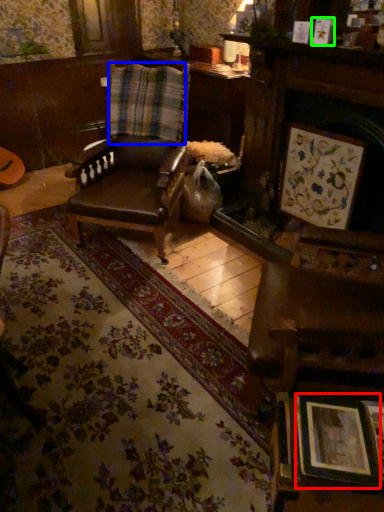
Question: Considering the real-world distances, which object is closest to picture frame (highlighted by a red box)? curtain (highlighted by a blue box) or picture frame (highlighted by a green box).

Choices:
 (A) curtain
 (B) picture frame

Answer: (B)